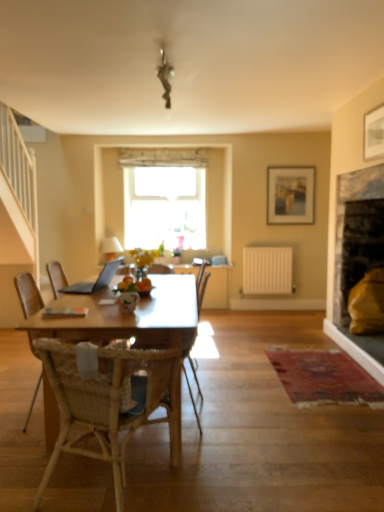
Find the location of `free location in front of woven wood chair at center, the 1th chair when ordered from back to front`. free location in front of woven wood chair at center, the 1th chair when ordered from back to front is located at coordinates (205, 444).